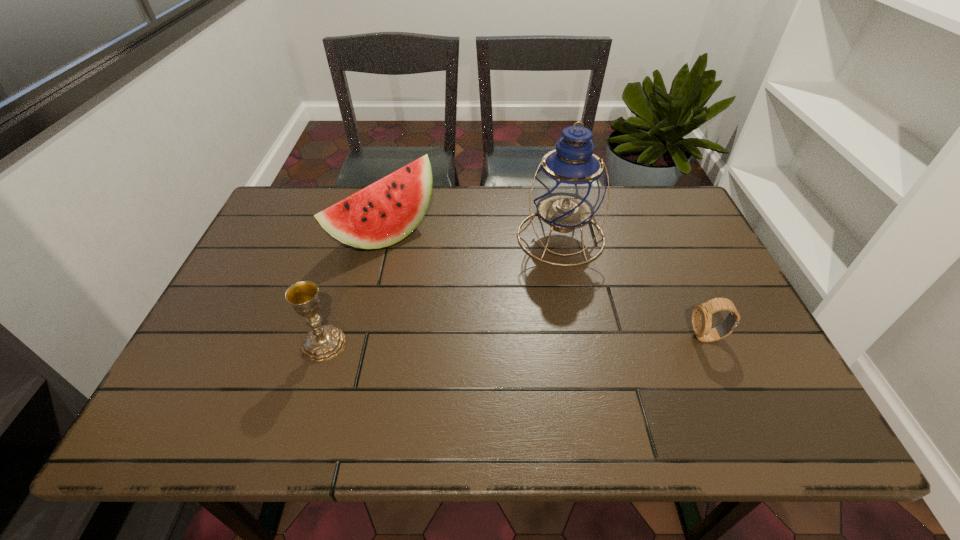
Find the location of a particular element. This screenshot has width=960, height=540. free space between the watermelon and the chalice is located at coordinates (355, 289).

This screenshot has width=960, height=540. Find the location of `unoccupied area between the watermelon and the rightmost object`. unoccupied area between the watermelon and the rightmost object is located at coordinates (546, 286).

Where is `free space between the watermelon and the rightmost object`? The width and height of the screenshot is (960, 540). free space between the watermelon and the rightmost object is located at coordinates (546, 286).

Where is `vacant area between the watermelon and the tallest object`? The image size is (960, 540). vacant area between the watermelon and the tallest object is located at coordinates (473, 235).

The width and height of the screenshot is (960, 540). Identify the location of free spot between the rightmost object and the tallest object. (634, 287).

Point out which object is positioned as the second nearest to the watch. Please provide its 2D coordinates. Your answer should be formatted as a tuple, i.e. [(x, y)], where the tuple contains the x and y coordinates of a point satisfying the conditions above.

[(385, 212)]

Where is `object that stands as the second closest to the chalice`? This screenshot has height=540, width=960. object that stands as the second closest to the chalice is located at coordinates (569, 187).

Image resolution: width=960 pixels, height=540 pixels. Identify the location of vacant space that satisfies the following two spatial constraints: 1. on the back side of the shortest object; 2. on the face of the chalice. (325, 337).

The image size is (960, 540). In order to click on free space that satisfies the following two spatial constraints: 1. on the back side of the chalice; 2. on the left side of the watermelon in this screenshot , I will do `click(357, 234)`.

You are a GUI agent. You are given a task and a screenshot of the screen. Output one action in this format:
    pyautogui.click(x=<x>, y=<y>)
    Task: Click on the free location that satisfies the following two spatial constraints: 1. on the front side of the watermelon; 2. on the face of the rightmost object
    The height and width of the screenshot is (540, 960).
    Given the screenshot: What is the action you would take?
    pyautogui.click(x=361, y=337)